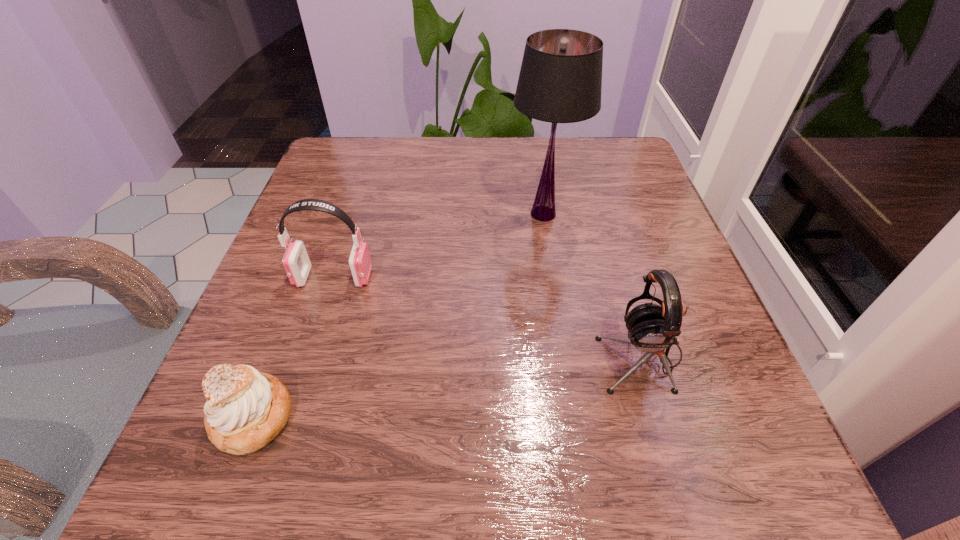
At what (x,y) coordinates should I click in order to perform the action: click on vacant space at the left edge. Please return your answer as a coordinate pair (x, y). Looking at the image, I should click on (311, 356).

Locate an element on the screen. The height and width of the screenshot is (540, 960). free space at the right edge of the desktop is located at coordinates (655, 364).

You are a GUI agent. You are given a task and a screenshot of the screen. Output one action in this format:
    pyautogui.click(x=<x>, y=<y>)
    Task: Click on the blank space at the far left corner
    This screenshot has height=540, width=960.
    Given the screenshot: What is the action you would take?
    pyautogui.click(x=359, y=138)

Identify the location of free space at the far right corner of the desktop. The height and width of the screenshot is (540, 960). (608, 173).

Where is `blank area at the near right corner`? Image resolution: width=960 pixels, height=540 pixels. blank area at the near right corner is located at coordinates coord(688,495).

Locate an element on the screen. vacant space in between the right earphone and the second farthest object is located at coordinates (488, 316).

This screenshot has width=960, height=540. I want to click on vacant point located between the farthest object and the right earphone, so (592, 285).

Locate an element on the screen. unoccupied position between the pastry and the farther earphone is located at coordinates pos(293,347).

Where is `vacant area that lies between the second farthest object and the nearer earphone`? The height and width of the screenshot is (540, 960). vacant area that lies between the second farthest object and the nearer earphone is located at coordinates (488, 316).

Identify the location of free space between the farther earphone and the pastry. (293, 347).